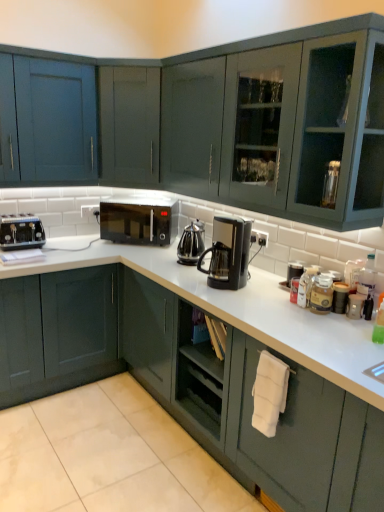
The image size is (384, 512). Find the location of `free point to the right of black plastic coffee maker at center`. free point to the right of black plastic coffee maker at center is located at coordinates (270, 285).